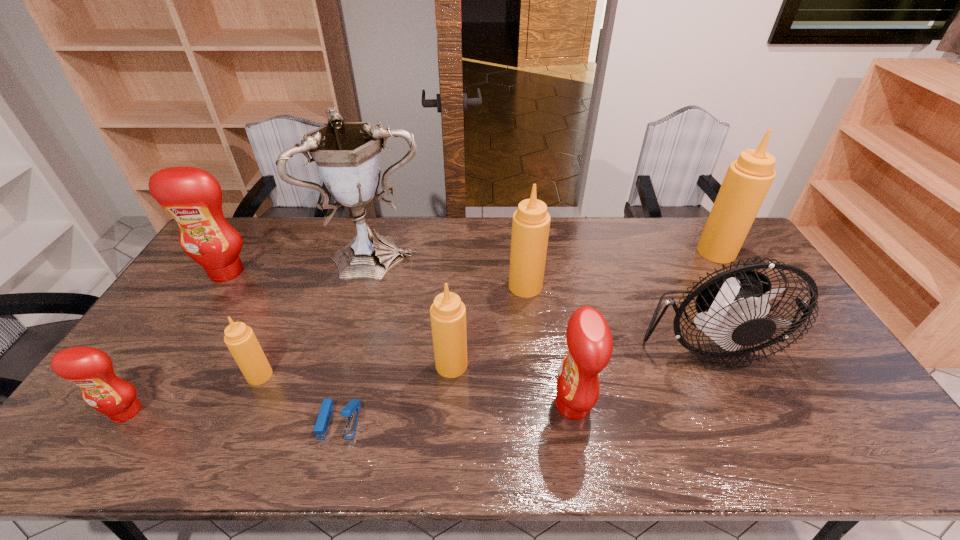
Where is `the smallest tan condiment`? the smallest tan condiment is located at coordinates (240, 339).

Identify the location of the leftmost tan condiment. (240, 339).

Where is `the smallest red condiment`? the smallest red condiment is located at coordinates point(91,369).

Find the location of `stapler`. stapler is located at coordinates (351, 410).

The width and height of the screenshot is (960, 540). I want to click on blue stapler, so click(x=351, y=410).

Locate an element on the screen. This screenshot has height=540, width=960. free space located 0.140m on the right of the trophy cup is located at coordinates (468, 254).

Where is `vacant space located 0.300m on the front of the tallest condiment`? Image resolution: width=960 pixels, height=540 pixels. vacant space located 0.300m on the front of the tallest condiment is located at coordinates (765, 330).

This screenshot has height=540, width=960. I want to click on vacant space located on the front of the second farthest tan condiment, so [x=534, y=360].

Where is `vacant space located on the label side of the biggest red condiment`? This screenshot has height=540, width=960. vacant space located on the label side of the biggest red condiment is located at coordinates (209, 300).

The image size is (960, 540). I want to click on vacant area situated in front of the fan, directing airflow, so click(x=739, y=403).